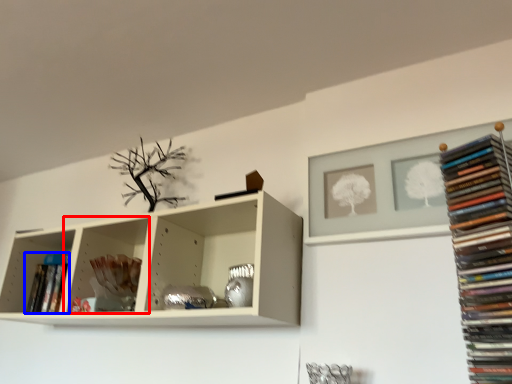
Question: Among these objects, which one is farthest to the camera, shelf (highlighted by a red box) or book (highlighted by a blue box)?

Choices:
 (A) shelf
 (B) book

Answer: (B)